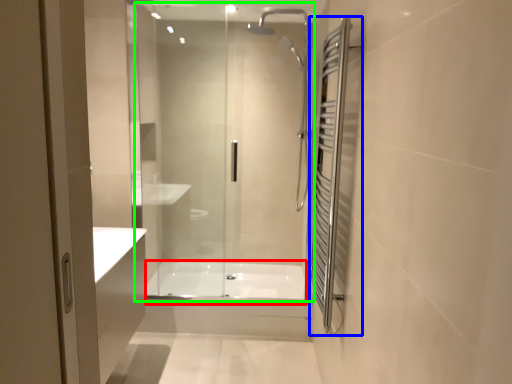
Question: Estimate the real-world distances between objects in this image. Which object is closer to bath (highlighted by a red box), screen door (highlighted by a blue box) or shower door (highlighted by a green box)?

Choices:
 (A) screen door
 (B) shower door

Answer: (B)